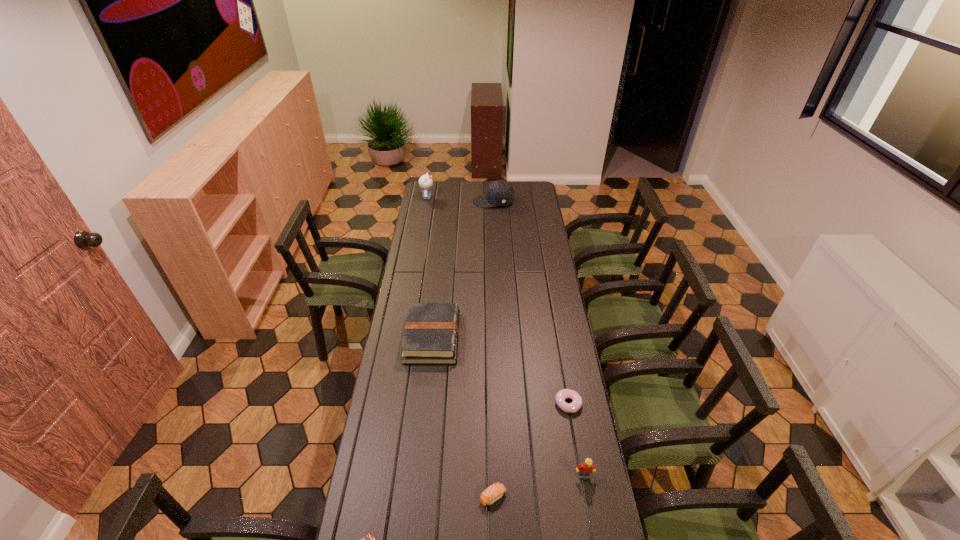
What are the coordinates of `free space located at the front of the baseball cap where the brim is located` in the screenshot? It's located at (424, 202).

At what (x,y) coordinates should I click in order to perform the action: click on free location located 0.210m at the front of the baseball cap where the brim is located. Please return your answer as a coordinate pair (x, y). The image size is (960, 540). Looking at the image, I should click on (439, 202).

Find the location of a particular element. free space located on the front-facing side of the Lego is located at coordinates (594, 534).

Where is `vacant space positioned 0.160m on the spine side of the fourth shortest object`? Image resolution: width=960 pixels, height=540 pixels. vacant space positioned 0.160m on the spine side of the fourth shortest object is located at coordinates (497, 338).

I want to click on vacant point located 0.380m on the back of the fourth farthest object, so click(554, 319).

At what (x,y) coordinates should I click in order to perform the action: click on vacant region located on the back of the sushi. Please return your answer as a coordinate pair (x, y). The image size is (960, 540). Looking at the image, I should click on [x=491, y=400].

At what (x,y) coordinates should I click in order to perform the action: click on kitten situated at the far edge. Please return your answer as a coordinate pair (x, y). This screenshot has height=540, width=960. Looking at the image, I should click on (425, 182).

Where is `baseball cap at the far edge`? This screenshot has width=960, height=540. baseball cap at the far edge is located at coordinates (500, 193).

This screenshot has height=540, width=960. What are the coordinates of `kitten that is at the left edge` in the screenshot? It's located at (425, 182).

Image resolution: width=960 pixels, height=540 pixels. I want to click on hardback book at the left edge, so click(431, 334).